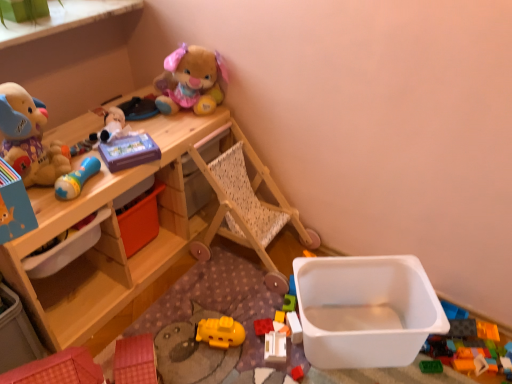
Find the location of a particular element. The image size is (512, 384). free space to the left of white plastic toy at center, the 1th toy from the bottom is located at coordinates (233, 354).